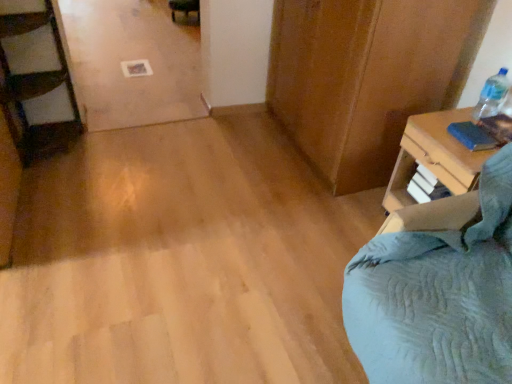
The image size is (512, 384). I want to click on blue fabric at right, so coord(434,157).

This screenshot has height=384, width=512. In order to click on blue matte book at upper right in this screenshot , I will do `click(473, 136)`.

The height and width of the screenshot is (384, 512). Find the location of `blue fabric at right`. blue fabric at right is located at coordinates pos(434,157).

Is clear plastic bottle at upper right in front of or behind blue fabric at right in the image?

Clearly, clear plastic bottle at upper right is behind blue fabric at right.

Is clear plastic bottle at upper right inside or outside of blue fabric at right?

clear plastic bottle at upper right is not enclosed by blue fabric at right.

Considering the sizes of objects clear plastic bottle at upper right and blue fabric at right in the image provided, who is bigger, clear plastic bottle at upper right or blue fabric at right?

blue fabric at right.

How much distance is there between clear plastic bottle at upper right and blue fabric at right?

23.82 centimeters.

Is clear plastic bottle at upper right wider than blue matte book at upper right?

No.

From the image's perspective, relative to blue matte book at upper right, is clear plastic bottle at upper right above or below?

From the image's perspective, clear plastic bottle at upper right appears above blue matte book at upper right.

From the picture: Is clear plastic bottle at upper right in front of blue matte book at upper right?

No, clear plastic bottle at upper right is further to the viewer.

Is blue matte book at upper right completely or partially inside clear plastic bottle at upper right?

Actually, blue matte book at upper right is outside clear plastic bottle at upper right.

Is point (417, 161) positioned after point (487, 107)?

No, it is in front of (487, 107).

Choose the correct answer: Is blue fabric at right inside clear plastic bottle at upper right or outside it?

blue fabric at right exists outside the volume of clear plastic bottle at upper right.

From the image's perspective, who appears lower, blue fabric at right or clear plastic bottle at upper right?

blue fabric at right appears lower in the image.

What's the angular difference between blue fabric at right and clear plastic bottle at upper right's facing directions?

2.53 degrees separate the facing orientations of blue fabric at right and clear plastic bottle at upper right.

From the image's perspective, which one is positioned lower, blue matte book at upper right or clear plastic bottle at upper right?

blue matte book at upper right, from the image's perspective.

From a real-world perspective, relative to clear plastic bottle at upper right, is blue matte book at upper right vertically above or below?

Clearly, from a real-world perspective, blue matte book at upper right is below clear plastic bottle at upper right.

Is blue matte book at upper right bigger or smaller than clear plastic bottle at upper right?

In the image, blue matte book at upper right appears to be smaller than clear plastic bottle at upper right.

Between blue matte book at upper right and clear plastic bottle at upper right, which one has more height?

With more height is clear plastic bottle at upper right.

Who is bigger, blue matte book at upper right or blue fabric at right?

With larger size is blue fabric at right.

Can you confirm if blue matte book at upper right is wider than blue fabric at right?

No.

Considering the positions of points (463, 130) and (448, 153), is point (463, 130) closer to camera compared to point (448, 153)?

No.

Can you confirm if blue matte book at upper right is taller than blue fabric at right?

Incorrect, the height of blue matte book at upper right is not larger of that of blue fabric at right.

Is blue fabric at right looking in the opposite direction of blue matte book at upper right?

No, blue fabric at right is not facing the opposite direction of blue matte book at upper right.

Are blue fabric at right and blue matte book at upper right far apart?

No.

Can you confirm if blue fabric at right is thinner than blue matte book at upper right?

No.

The width and height of the screenshot is (512, 384). In order to click on nightstand that appears below the clear plastic bottle at upper right (from the image's perspective) in this screenshot , I will do `click(434, 157)`.

The width and height of the screenshot is (512, 384). Identify the location of bottle on the right side of blue matte book at upper right. tap(490, 95).

Which object lies further to the anchor point blue matte book at upper right, clear plastic bottle at upper right or blue fabric at right?

clear plastic bottle at upper right is positioned further to the anchor blue matte book at upper right.

From the image, which object appears to be nearer to clear plastic bottle at upper right, blue fabric at right or blue matte book at upper right?

blue matte book at upper right is closer to clear plastic bottle at upper right.

Estimate the real-world distances between objects in this image. Which object is closer to blue fabric at right, blue matte book at upper right or clear plastic bottle at upper right?

blue matte book at upper right lies closer to blue fabric at right than the other object.

When comparing their distances from clear plastic bottle at upper right, does blue matte book at upper right or blue fabric at right seem further?

The object further to clear plastic bottle at upper right is blue fabric at right.

From the image, which object appears to be nearer to blue fabric at right, clear plastic bottle at upper right or blue matte book at upper right?

blue matte book at upper right lies closer to blue fabric at right than the other object.

When comparing their distances from blue matte book at upper right, does blue fabric at right or clear plastic bottle at upper right seem closer?

blue fabric at right is closer to blue matte book at upper right.

What are the coordinates of `book that lies between clear plastic bottle at upper right and blue fabric at right from top to bottom` in the screenshot? It's located at (473, 136).